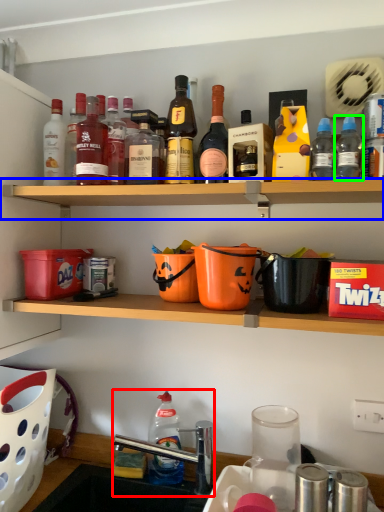
Question: Considering the real-world distances, which object is farthest from sink (highlighted by a red box)? shelf (highlighted by a blue box) or bottle (highlighted by a green box)?

Choices:
 (A) shelf
 (B) bottle

Answer: (B)